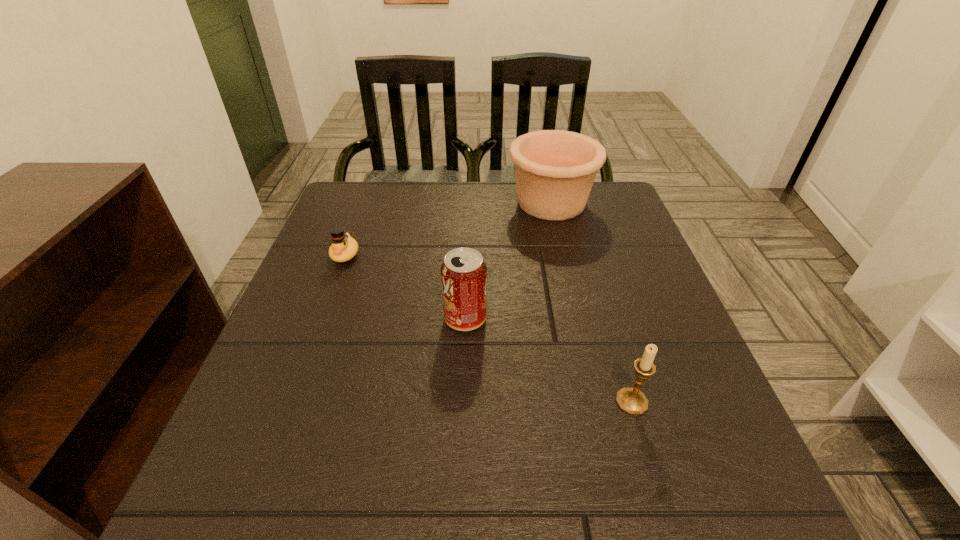
This screenshot has height=540, width=960. I want to click on object positioned at the far edge, so click(x=555, y=170).

At what (x,y) coordinates should I click in order to perform the action: click on object located in the left edge section of the desktop. Please return your answer as a coordinate pair (x, y). The width and height of the screenshot is (960, 540). Looking at the image, I should click on (343, 247).

Find the location of a particular element. The height and width of the screenshot is (540, 960). pottery that is at the right edge is located at coordinates (555, 170).

Find the location of `candle holder located at the right edge`. candle holder located at the right edge is located at coordinates (631, 400).

You are a GUI agent. You are given a task and a screenshot of the screen. Output one action in this format:
    pyautogui.click(x=<x>, y=<y>)
    Task: Click on the object that is at the far right corner
    Image resolution: width=960 pixels, height=540 pixels.
    Given the screenshot: What is the action you would take?
    555,170

Identify the location of vacant region at the far edge of the desktop. (484, 195).

In the image, there is a desktop. Where is `vacant space at the near edge`? vacant space at the near edge is located at coordinates (397, 497).

The width and height of the screenshot is (960, 540). Identify the location of vacant space at the left edge of the desktop. (307, 261).

In the image, there is a desktop. Where is `vacant space at the right edge`? This screenshot has width=960, height=540. vacant space at the right edge is located at coordinates (708, 383).

The image size is (960, 540). In the image, there is a desktop. In order to click on vacant space at the far left corner in this screenshot , I will do `click(346, 185)`.